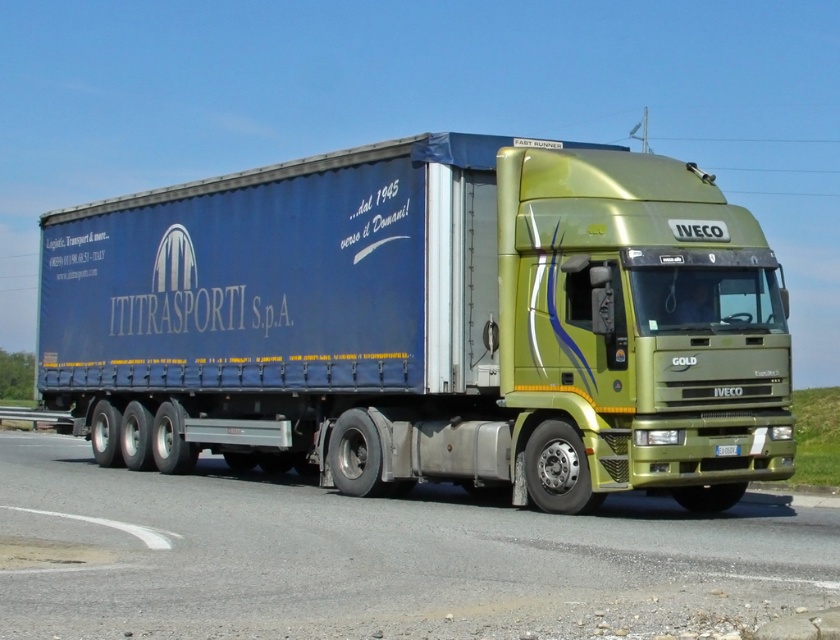
Which is above, metallic gold truck at center or green metallic highway at center?

Positioned higher is metallic gold truck at center.

Can you confirm if metallic gold truck at center is bigger than green metallic highway at center?

Yes, metallic gold truck at center is bigger than green metallic highway at center.

At what (x,y) coordinates should I click in order to perform the action: click on metallic gold truck at center. Please return your answer as a coordinate pair (x, y). The height and width of the screenshot is (640, 840). Looking at the image, I should click on (429, 323).